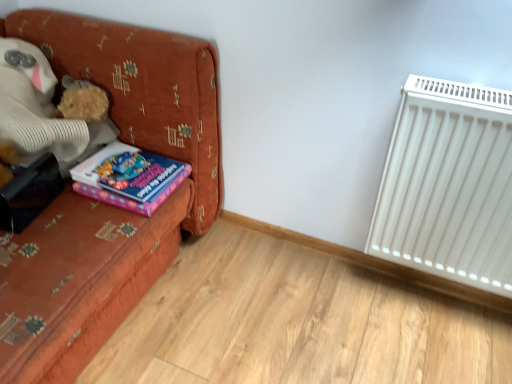
Where is `fluffy beige teddy bear at left`? Image resolution: width=512 pixels, height=384 pixels. fluffy beige teddy bear at left is located at coordinates (35, 108).

Where is `purple matte book at left`? Image resolution: width=512 pixels, height=384 pixels. purple matte book at left is located at coordinates (129, 177).

This screenshot has width=512, height=384. What do you see at coordinates (449, 185) in the screenshot?
I see `white plastic radiator at right` at bounding box center [449, 185].

What is the approximate height of white plastic radiator at right?

white plastic radiator at right is 23.98 inches in height.

Where is `fluffy beige teddy bear at left`? This screenshot has width=512, height=384. fluffy beige teddy bear at left is located at coordinates (35, 108).

Considering the relative positions of white plastic radiator at right and fluffy beige teddy bear at left in the image provided, is white plastic radiator at right behind fluffy beige teddy bear at left?

That is False.

Which is less distant, (466, 156) or (52, 107)?

Point (466, 156) appears to be closer to the viewer than point (52, 107).

Which of these two, white plastic radiator at right or fluffy beige teddy bear at left, is bigger?

fluffy beige teddy bear at left is bigger.

From the image's perspective, is white plastic radiator at right above fluffy beige teddy bear at left?

Incorrect, from the image's perspective, white plastic radiator at right is lower than fluffy beige teddy bear at left.

Is the depth of purple matte book at left greater than that of white plastic radiator at right?

That is True.

From a real-world perspective, is purple matte book at left under white plastic radiator at right?

Yes.

Can you confirm if purple matte book at left is bigger than white plastic radiator at right?

No.

Between fluffy beige teddy bear at left and white plastic radiator at right, which one has more height?

white plastic radiator at right is taller.

In the image, is fluffy beige teddy bear at left positioned in front of or behind white plastic radiator at right?

fluffy beige teddy bear at left is behind white plastic radiator at right.

Measure the distance between fluffy beige teddy bear at left and white plastic radiator at right.

They are 3.66 feet apart.

Is fluffy beige teddy bear at left in contact with white plastic radiator at right?

fluffy beige teddy bear at left and white plastic radiator at right are clearly separated.

From the image's perspective, does velvet orange couch at left appear lower than white plastic radiator at right?

No, from the image's perspective, velvet orange couch at left is not below white plastic radiator at right.

This screenshot has width=512, height=384. What are the coordinates of `furniture in front of the white plastic radiator at right` in the screenshot? It's located at (106, 204).

Which of these two, velvet orange couch at left or white plastic radiator at right, stands shorter?

white plastic radiator at right.

Does velvet orange couch at left contain purple matte book at left?

Yes, purple matte book at left can be found within velvet orange couch at left.

Looking at this image, between velvet orange couch at left and purple matte book at left, which one appears on the left side from the viewer's perspective?

velvet orange couch at left.

Is velvet orange couch at left in front of purple matte book at left?

Yes, it is in front of purple matte book at left.

Could you tell me if velvet orange couch at left is turned towards purple matte book at left?

Yes.

Does white plastic radiator at right touch velvet orange couch at left?

There is a gap between white plastic radiator at right and velvet orange couch at left.

How different are the orientations of white plastic radiator at right and velvet orange couch at left in degrees?

The facing directions of white plastic radiator at right and velvet orange couch at left are 92.9 degrees apart.

From the image's perspective, would you say white plastic radiator at right is shown under velvet orange couch at left?

Yes, from the image's perspective, white plastic radiator at right is below velvet orange couch at left.

Considering the sizes of objects white plastic radiator at right and velvet orange couch at left in the image provided, who is bigger, white plastic radiator at right or velvet orange couch at left?

With larger size is velvet orange couch at left.

Which is behind, velvet orange couch at left or fluffy beige teddy bear at left?

fluffy beige teddy bear at left is behind.

Based on the photo, could fluffy beige teddy bear at left be considered to be inside velvet orange couch at left?

Yes.

Who is shorter, velvet orange couch at left or fluffy beige teddy bear at left?

fluffy beige teddy bear at left.

Are velvet orange couch at left and fluffy beige teddy bear at left far apart?

No, velvet orange couch at left is not far from fluffy beige teddy bear at left.

Find the location of `radiator located on the right of fluffy beige teddy bear at left`. radiator located on the right of fluffy beige teddy bear at left is located at coordinates (449, 185).

In order to click on book below the white plastic radiator at right (from a real-world perspective) in this screenshot , I will do `click(129, 177)`.

Looking at the image, which one is located further to fluffy beige teddy bear at left, white plastic radiator at right or purple matte book at left?

white plastic radiator at right lies further to fluffy beige teddy bear at left than the other object.

Which object lies nearer to the anchor point white plastic radiator at right, velvet orange couch at left or fluffy beige teddy bear at left?

Based on the image, velvet orange couch at left appears to be nearer to white plastic radiator at right.

Which object lies nearer to the anchor point white plastic radiator at right, fluffy beige teddy bear at left or velvet orange couch at left?

Based on the image, velvet orange couch at left appears to be nearer to white plastic radiator at right.

When comparing their distances from white plastic radiator at right, does purple matte book at left or velvet orange couch at left seem closer?

velvet orange couch at left lies closer to white plastic radiator at right than the other object.

Which object lies further to the anchor point white plastic radiator at right, purple matte book at left or fluffy beige teddy bear at left?

Among the two, fluffy beige teddy bear at left is located further to white plastic radiator at right.

Estimate the real-world distances between objects in this image. Which object is closer to white plastic radiator at right, fluffy beige teddy bear at left or purple matte book at left?

purple matte book at left.

Consider the image. Which object lies further to the anchor point fluffy beige teddy bear at left, velvet orange couch at left or white plastic radiator at right?

white plastic radiator at right is further to fluffy beige teddy bear at left.

Which object lies nearer to the anchor point purple matte book at left, fluffy beige teddy bear at left or velvet orange couch at left?

Among the two, velvet orange couch at left is located nearer to purple matte book at left.

Find the location of a particular element. The image size is (512, 384). book between velvet orange couch at left and white plastic radiator at right is located at coordinates (129, 177).

This screenshot has height=384, width=512. I want to click on book between fluffy beige teddy bear at left and white plastic radiator at right in the horizontal direction, so click(x=129, y=177).

This screenshot has height=384, width=512. I want to click on teddy between velvet orange couch at left and purple matte book at left from front to back, so click(x=35, y=108).

Where is `furniture situated between fluffy beige teddy bear at left and white plastic radiator at right from left to right`? The width and height of the screenshot is (512, 384). furniture situated between fluffy beige teddy bear at left and white plastic radiator at right from left to right is located at coordinates (106, 204).